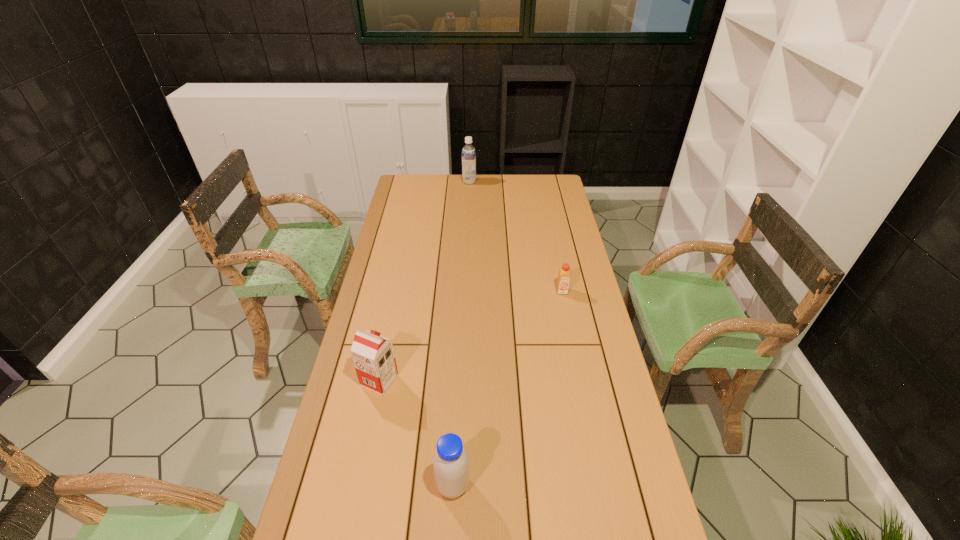
This screenshot has width=960, height=540. Find the location of `free spot between the farthest object and the second nearest soya milk`. free spot between the farthest object and the second nearest soya milk is located at coordinates (424, 281).

Where is `free space between the third nearest object and the farthest soya milk`? free space between the third nearest object and the farthest soya milk is located at coordinates (516, 236).

This screenshot has width=960, height=540. Find the location of `vacant space in between the leftmost object and the nearest soya milk`. vacant space in between the leftmost object and the nearest soya milk is located at coordinates (417, 433).

Where is `unoccupied area between the second nearest object and the nearest soya milk`? Image resolution: width=960 pixels, height=540 pixels. unoccupied area between the second nearest object and the nearest soya milk is located at coordinates (417, 433).

Image resolution: width=960 pixels, height=540 pixels. In order to click on free space that is in between the leftmost object and the rightmost object in this screenshot , I will do `click(470, 336)`.

I want to click on free point between the orange juice and the farthest object, so click(x=516, y=236).

Locate an element on the screen. This screenshot has height=540, width=960. free space between the leftmost soya milk and the rightmost object is located at coordinates (470, 336).

Identify which object is the third closest to the rightmost object. Please provide its 2D coordinates. Your answer should be formatted as a tuple, i.e. [(x, y)], where the tuple contains the x and y coordinates of a point satisfying the conditions above.

[(468, 152)]

This screenshot has height=540, width=960. I want to click on object that can be found as the third closest to the leftmost object, so click(468, 152).

Identify which soya milk is located as the second nearest to the nearest soya milk. Please provide its 2D coordinates. Your answer should be formatted as a tuple, i.e. [(x, y)], where the tuple contains the x and y coordinates of a point satisfying the conditions above.

[(468, 152)]